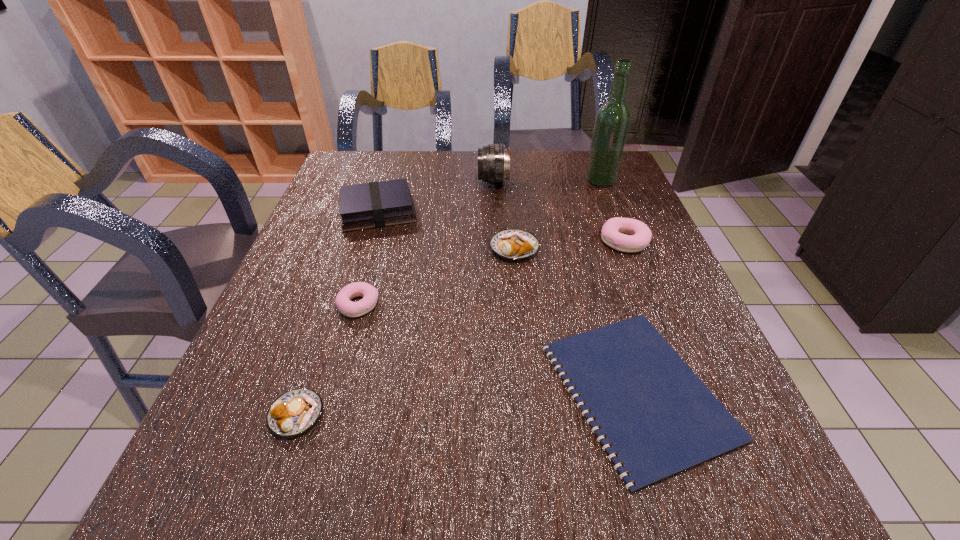
This screenshot has height=540, width=960. I want to click on the nearer pink pastry, so click(x=369, y=293).

Locate an element on the screen. The width and height of the screenshot is (960, 540). the left brown pastry is located at coordinates (294, 412).

I want to click on the smaller brown pastry, so click(294, 412).

This screenshot has width=960, height=540. I want to click on blue notepad, so click(x=660, y=419).

You are a GUI agent. You are given a task and a screenshot of the screen. Output one action in this format:
    pyautogui.click(x=<x>, y=<y>)
    Task: Click on the shortest object
    The width and height of the screenshot is (960, 540).
    Given the screenshot: What is the action you would take?
    pyautogui.click(x=660, y=419)

In order to click on free space located 0.110m on the front of the green liquor in this screenshot , I will do `click(612, 210)`.

Where is `vacant area situated at the front element of the seventh shortest object`? The width and height of the screenshot is (960, 540). vacant area situated at the front element of the seventh shortest object is located at coordinates (454, 181).

Where is `free space located at the front element of the seventh shortest object`? This screenshot has width=960, height=540. free space located at the front element of the seventh shortest object is located at coordinates (461, 181).

Find the location of a particular element. This screenshot has width=960, height=540. vacant space located at the front element of the seventh shortest object is located at coordinates (431, 181).

Locate an element on the screen. The image size is (960, 540). vacant space positioned on the right of the book is located at coordinates (548, 212).